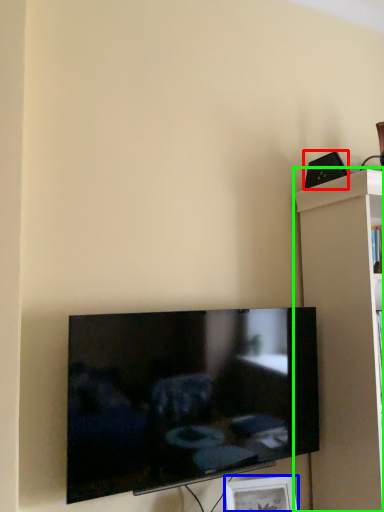
Question: Considering the real-world distances, which object is closest to speaker (highlighted by a red box)? picture frame (highlighted by a blue box) or shelf (highlighted by a green box).

Choices:
 (A) picture frame
 (B) shelf

Answer: (B)